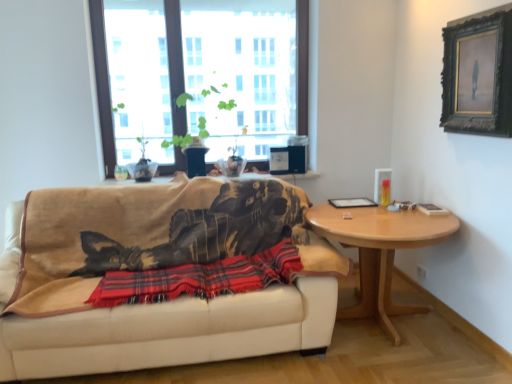
This screenshot has width=512, height=384. In order to click on vacant space that's between beige fabric couch at center and light brown wooden table at right in this screenshot , I will do `click(398, 356)`.